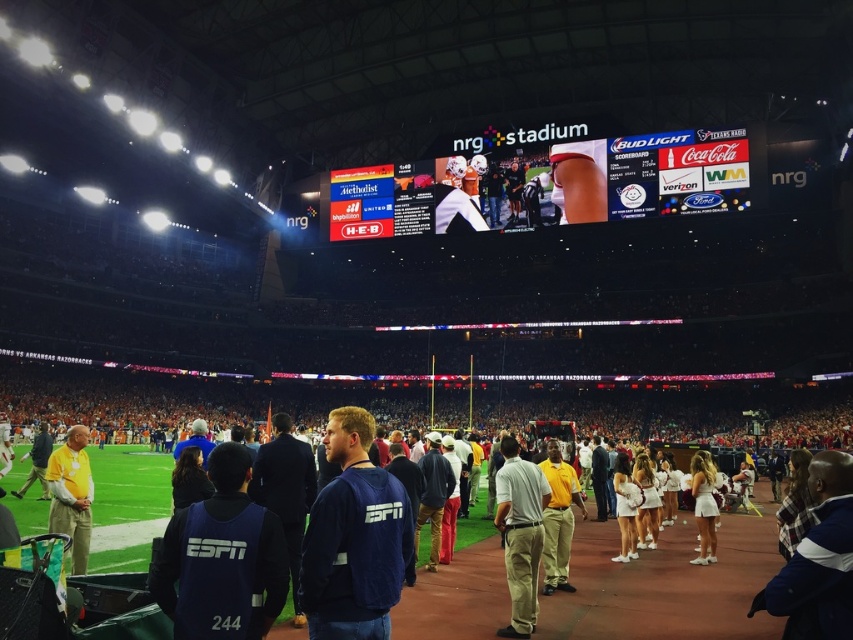
Does navy blue jacket at center appear on the right side of white fabric cheerleader at center?

No, navy blue jacket at center is not to the right of white fabric cheerleader at center.

Does navy blue jacket at center appear on the left side of white fabric cheerleader at center?

Correct, you'll find navy blue jacket at center to the left of white fabric cheerleader at center.

Between point (349, 595) and point (640, 497), which one is positioned behind?

Point (640, 497)

Locate an element on the screen. The height and width of the screenshot is (640, 853). navy blue jacket at center is located at coordinates (354, 538).

Which of these two, khaki pants at center or yellow matte shirt at lower left, stands shorter?

Standing shorter between the two is khaki pants at center.

The height and width of the screenshot is (640, 853). Find the location of `khaki pants at center`. khaki pants at center is located at coordinates (520, 534).

Is point (549, 499) more distant than point (50, 484)?

Yes, it is behind point (50, 484).

Find the location of a particular element. This screenshot has height=640, width=853. khaki pants at center is located at coordinates (520, 534).

In the scene shown: Measure the distance between yellow matte shirt at lower left and white fabric cheerleader at center.

They are 115.59 feet apart.

This screenshot has width=853, height=640. In order to click on yellow matte shirt at lower left in this screenshot , I will do `click(71, 493)`.

The image size is (853, 640). In order to click on yellow matte shirt at lower left in this screenshot , I will do `click(71, 493)`.